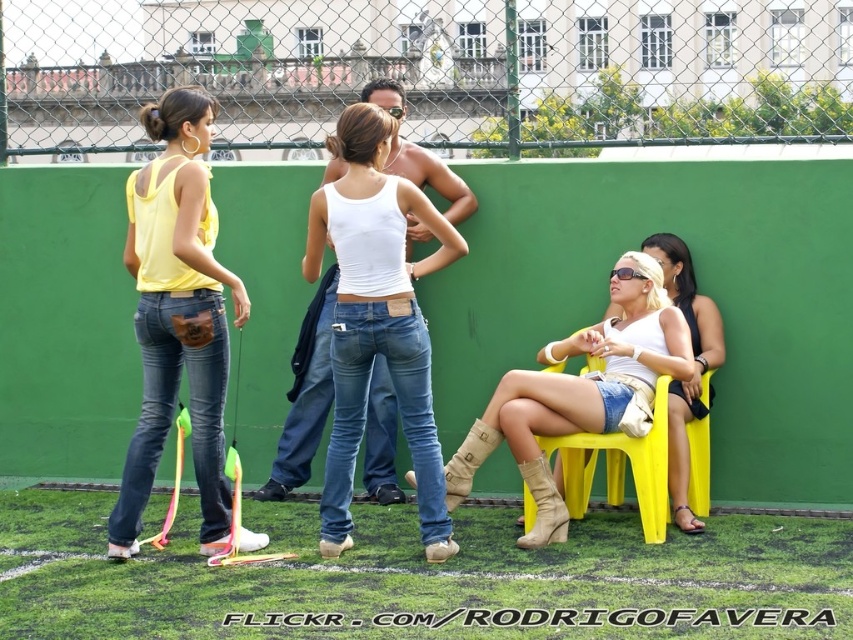
Is yellow plastic chair at lower center shorter than leather boots at lower center?

No, yellow plastic chair at lower center is not shorter than leather boots at lower center.

At what (x,y) coordinates should I click in order to perform the action: click on yellow plastic chair at lower center. Please return your answer as a coordinate pair (x, y). The image size is (853, 640). Looking at the image, I should click on (619, 467).

Where is `yellow matte tank top at left`? The width and height of the screenshot is (853, 640). yellow matte tank top at left is located at coordinates (177, 314).

Is yellow matte tank top at left taller than leather boots at lower center?

Correct, yellow matte tank top at left is much taller as leather boots at lower center.

Which is in front, point (177, 376) or point (453, 502)?

Positioned in front is point (453, 502).

You are a GUI agent. You are given a task and a screenshot of the screen. Output one action in this format:
    pyautogui.click(x=<x>, y=<y>)
    Task: Click on the yellow matte tank top at left
    Image resolution: width=853 pixels, height=640 pixels.
    Given the screenshot: What is the action you would take?
    pyautogui.click(x=177, y=314)

Can you confirm if white matte tank top at center is bigger than yellow plastic chair at lower center?

Yes.

Does white matte tank top at center have a greater height compared to yellow plastic chair at lower center?

Yes.

This screenshot has width=853, height=640. What do you see at coordinates (376, 317) in the screenshot?
I see `white matte tank top at center` at bounding box center [376, 317].

You are a GUI agent. You are given a task and a screenshot of the screen. Output one action in this format:
    pyautogui.click(x=<x>, y=<y>)
    Task: Click on the white matte tank top at center
    
    Given the screenshot: What is the action you would take?
    pyautogui.click(x=376, y=317)